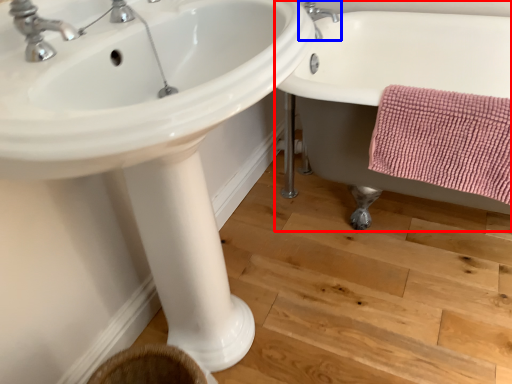
Question: Which object is closer to the camera taking this photo, bathtub (highlighted by a red box) or tap (highlighted by a blue box)?

Choices:
 (A) bathtub
 (B) tap

Answer: (A)